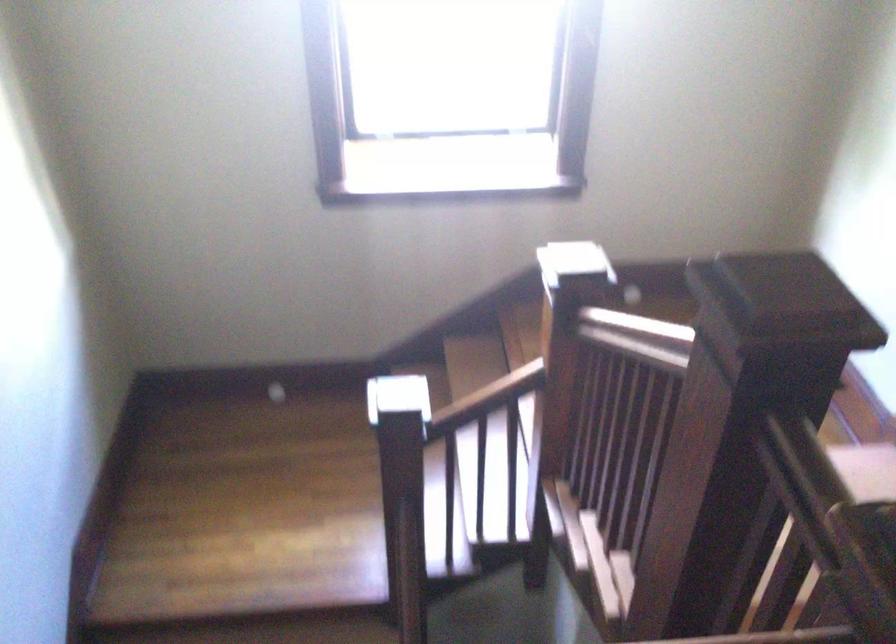
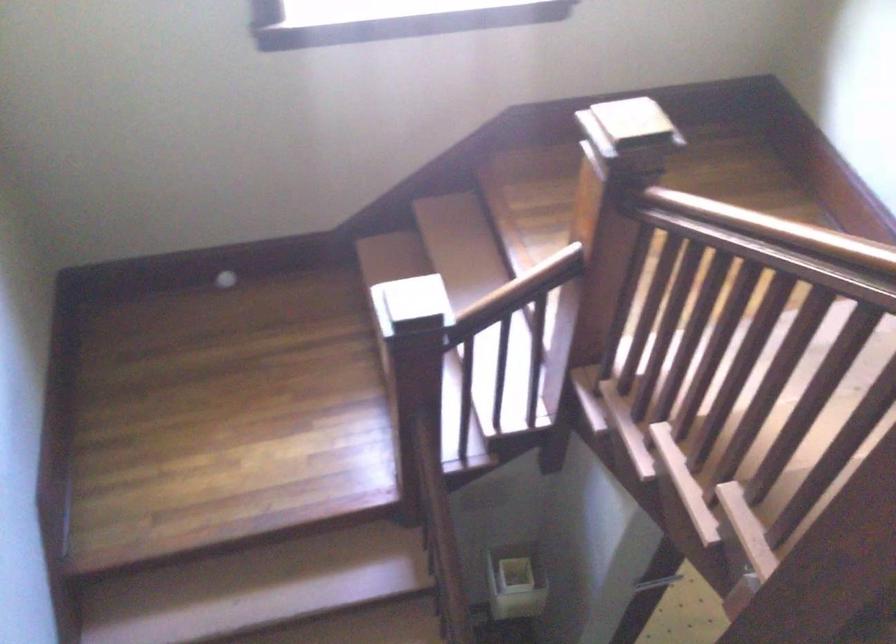
Question: How did the camera likely rotate?

Choices:
 (A) Left
 (B) Right
 (C) Up
 (D) Down

Answer: (D)